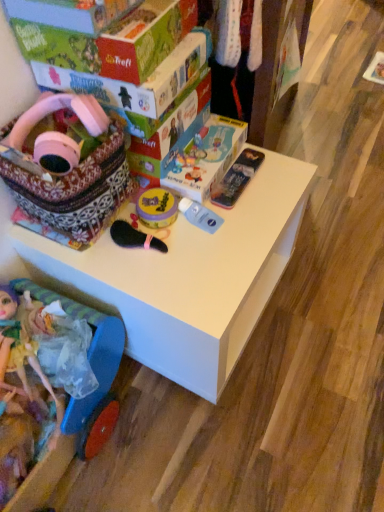
Question: In the image, is plastic doll at lower left, which appears as the first toy when viewed from the left, positioned in front of or behind green cardboard box at upper left, which ranks as the 2th box in back-to-front order?

Choices:
 (A) behind
 (B) front

Answer: (B)

Question: From a real-world perspective, relative to green cardboard box at upper left, the 1th box in the front-to-back sequence, is plastic doll at lower left, which appears as the first toy when viewed from the left, vertically above or below?

Choices:
 (A) above
 (B) below

Answer: (B)

Question: Estimate the real-world distances between objects in this image. Which object is farther from the patterned fabric basket at upper left, placed as the 3th toy when sorted from left to right?

Choices:
 (A) matte cardboard box at upper center, which is counted as the 2th box, starting from the front
 (B) pink matte headphones at upper left, which is counted as the fifth toy, starting from the right
 (C) white matte table at center
 (D) plastic doll at lower left, placed as the sixth toy when sorted from right to left
 (E) yellow matte jar at center, positioned as the 3th toy in right-to-left order

Answer: (D)

Question: Which of these objects is positioned closest to the plastic doll at lower left, which appears as the first toy when viewed from the left?

Choices:
 (A) matte cardboard box at upper center, which is counted as the 2th box, starting from the front
 (B) pink matte headphones at upper left, which is counted as the fifth toy, starting from the right
 (C) transparent plastic bottle at center, positioned as the fifth toy in left-to-right order
 (D) yellow matte jar at center, positioned as the 3th toy in right-to-left order
 (E) metallic plastic pencil case at upper right, arranged as the 1th toy when viewed from the right

Answer: (D)